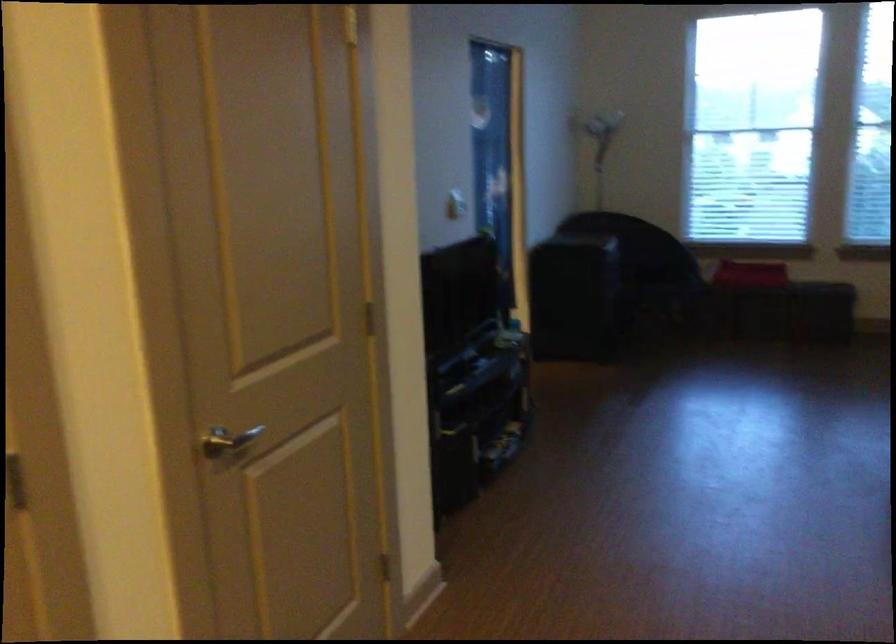
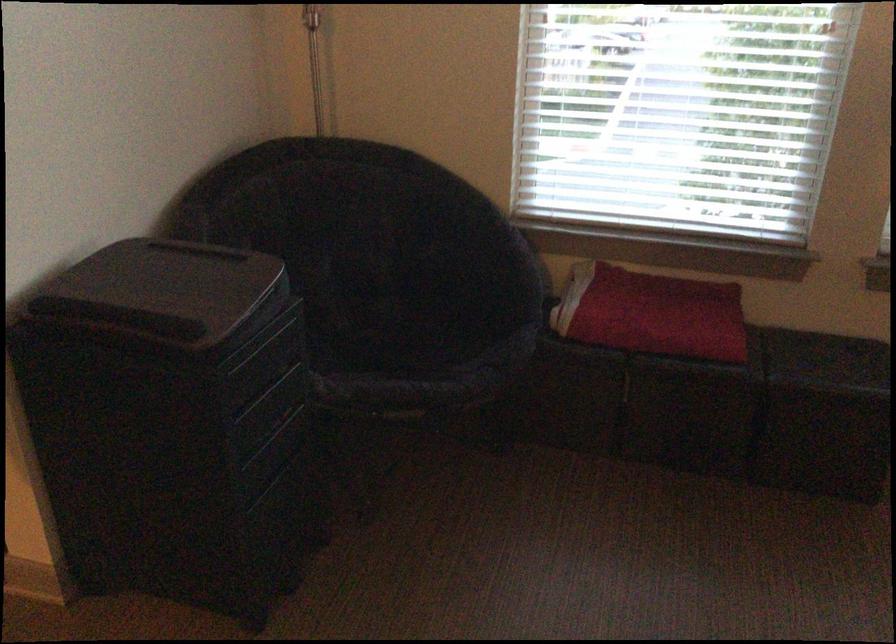
Find the pixel in the second image that matches (x=747, y=263) in the first image.

(651, 313)